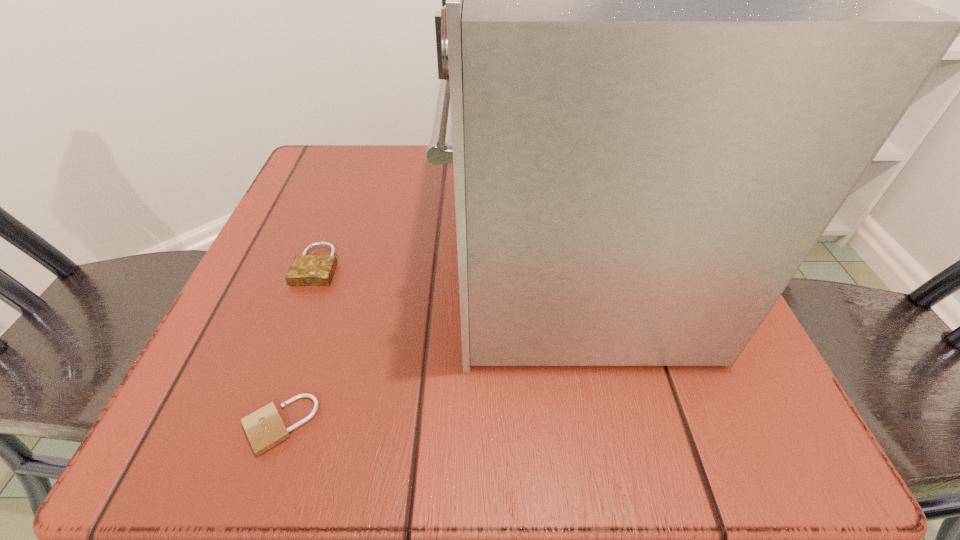
Find the location of a particular element. The height and width of the screenshot is (540, 960). free region located on the back of the shortest object is located at coordinates (342, 241).

Locate an element on the screen. The height and width of the screenshot is (540, 960). object located in the far edge section of the desktop is located at coordinates (677, 26).

This screenshot has width=960, height=540. I want to click on object that is at the near edge, so click(x=265, y=428).

I want to click on object that is at the right edge, so click(677, 26).

Identify the location of object located at the near left corner. This screenshot has width=960, height=540. (x=265, y=428).

The width and height of the screenshot is (960, 540). I want to click on object that is at the far right corner, so click(x=677, y=26).

The width and height of the screenshot is (960, 540). I want to click on vacant region at the far edge, so click(405, 148).

Where is `free space at the left edge`? The height and width of the screenshot is (540, 960). free space at the left edge is located at coordinates [250, 309].

Where is `free space at the far left corner of the desktop`? This screenshot has width=960, height=540. free space at the far left corner of the desktop is located at coordinates (351, 165).

In the image, there is a desktop. At what (x,y) coordinates should I click in order to perform the action: click on vacant space at the near right corner. Please return your answer as a coordinate pair (x, y). The height and width of the screenshot is (540, 960). Looking at the image, I should click on (758, 445).